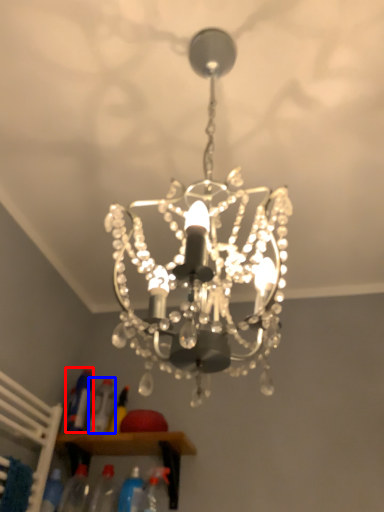
Question: Which object is closer to the camera taking this photo, bottle (highlighted by a red box) or bottle (highlighted by a blue box)?

Choices:
 (A) bottle
 (B) bottle

Answer: (B)